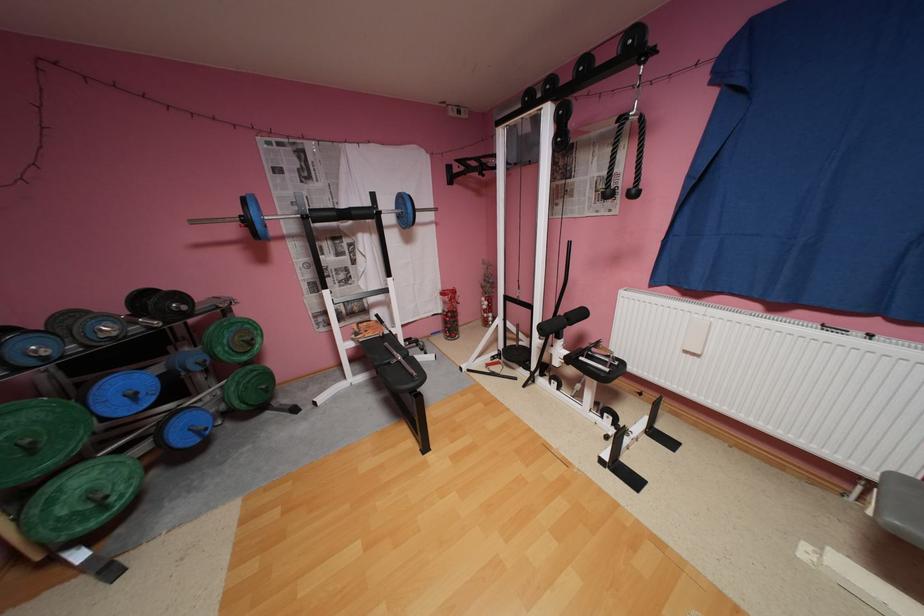
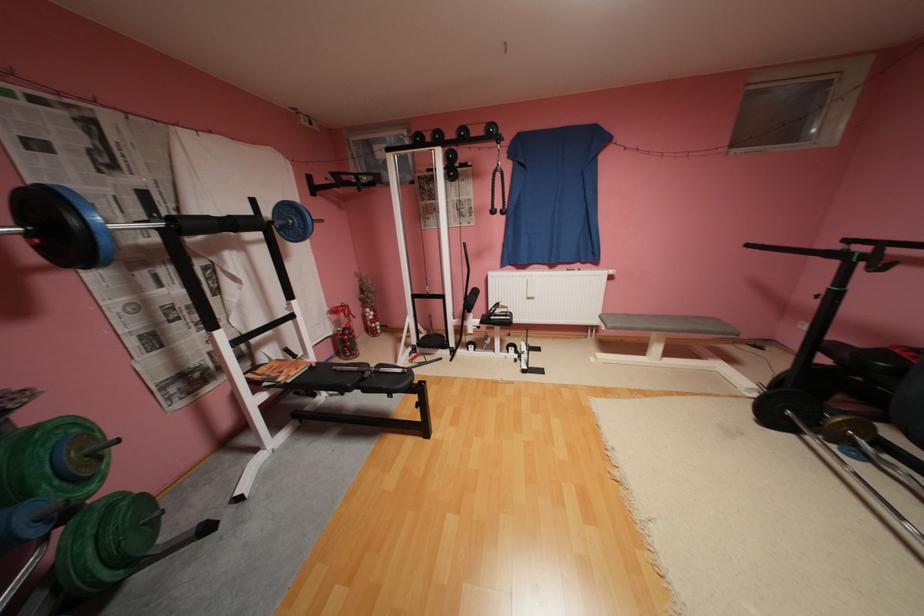
In the second image, find the point that corresponds to point (390, 212) in the first image.

(281, 223)